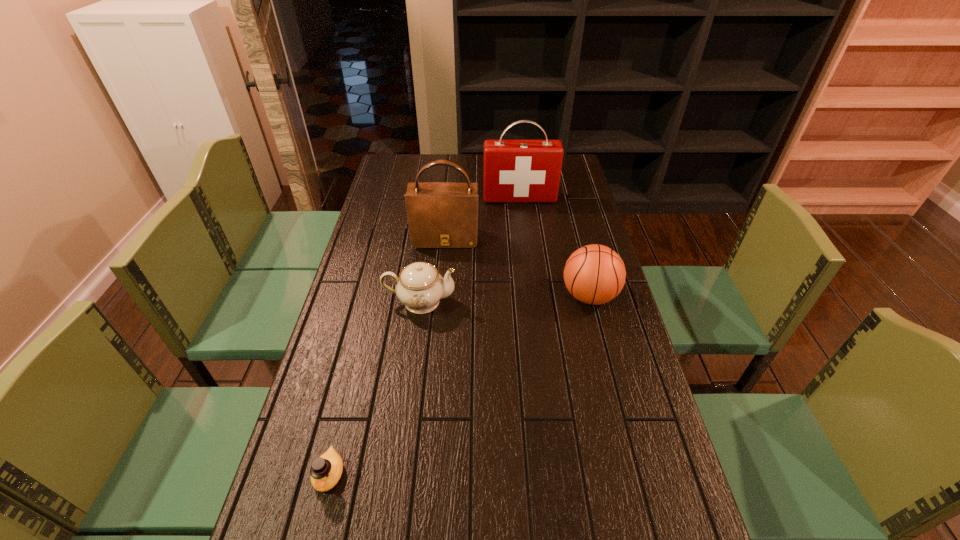
Identify the location of free spot that satisfies the following two spatial constraints: 1. on the front flap of the third shortest object; 2. on the left side of the shoulder bag. The height and width of the screenshot is (540, 960). (440, 296).

Image resolution: width=960 pixels, height=540 pixels. In order to click on free space that satisfies the following two spatial constraints: 1. on the front face of the basketball; 2. on the left side of the farthest object in this screenshot , I will do (x=531, y=296).

You are a GUI agent. You are given a task and a screenshot of the screen. Output one action in this format:
    pyautogui.click(x=<x>, y=<y>)
    Task: Click on the vacant space that satisfies the following two spatial constraints: 1. at the spout of the fourth tallest object; 2. on the front-facing side of the leftmost object
    
    Given the screenshot: What is the action you would take?
    pyautogui.click(x=396, y=474)

Locate an element on the screen. free spot that satisfies the following two spatial constraints: 1. on the front flap of the third shortest object; 2. on the left side of the fourth nearest object is located at coordinates (440, 296).